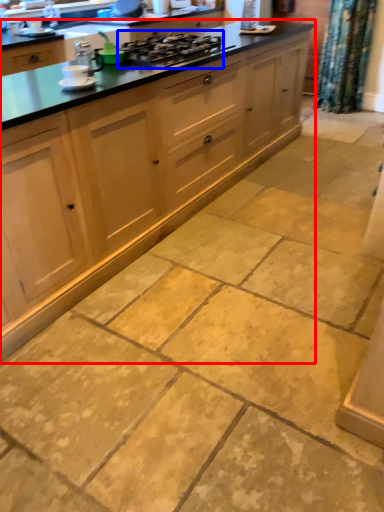
Question: Which object is further to the camera taking this photo, cabinetry (highlighted by a red box) or gas stove (highlighted by a blue box)?

Choices:
 (A) cabinetry
 (B) gas stove

Answer: (B)